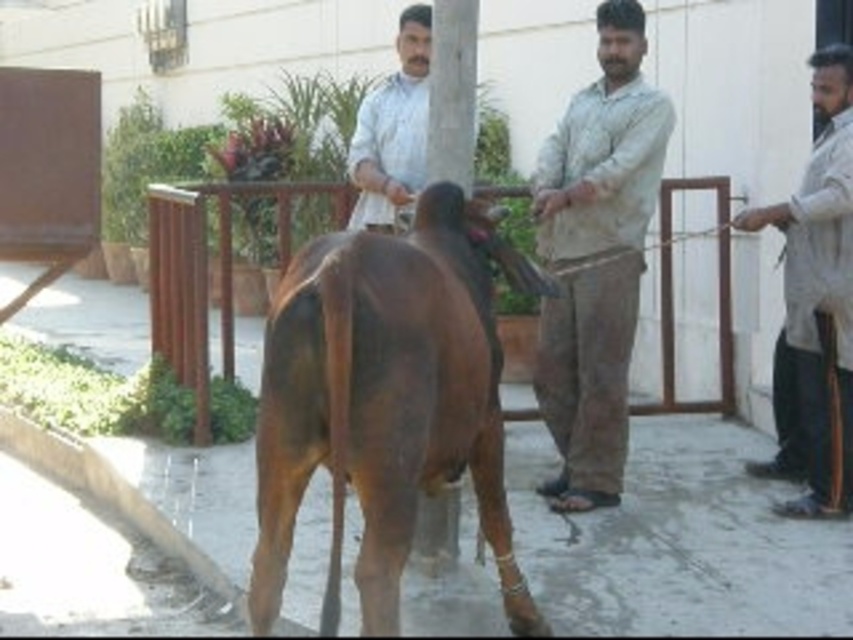
Question: Does brown glossy bull at center lie in front of light beige shirt at right?

Choices:
 (A) yes
 (B) no

Answer: (A)

Question: Can you confirm if light beige cotton shirt at center is positioned above light beige shirt at right?

Choices:
 (A) no
 (B) yes

Answer: (B)

Question: Is brown glossy bull at center smaller than light beige shirt at right?

Choices:
 (A) no
 (B) yes

Answer: (A)

Question: Among these objects, which one is nearest to the camera?

Choices:
 (A) light beige cotton shirt at center
 (B) light beige shirt at right
 (C) brown glossy bull at center
 (D) white matte shirt at center

Answer: (C)

Question: Which is nearer to the brown glossy bull at center?

Choices:
 (A) light beige cotton shirt at center
 (B) white matte shirt at center
 (C) light beige shirt at right

Answer: (A)

Question: Which point is farther from the camera taking this photo?

Choices:
 (A) (x=267, y=557)
 (B) (x=827, y=228)
 (C) (x=553, y=307)
 (D) (x=424, y=93)

Answer: (D)